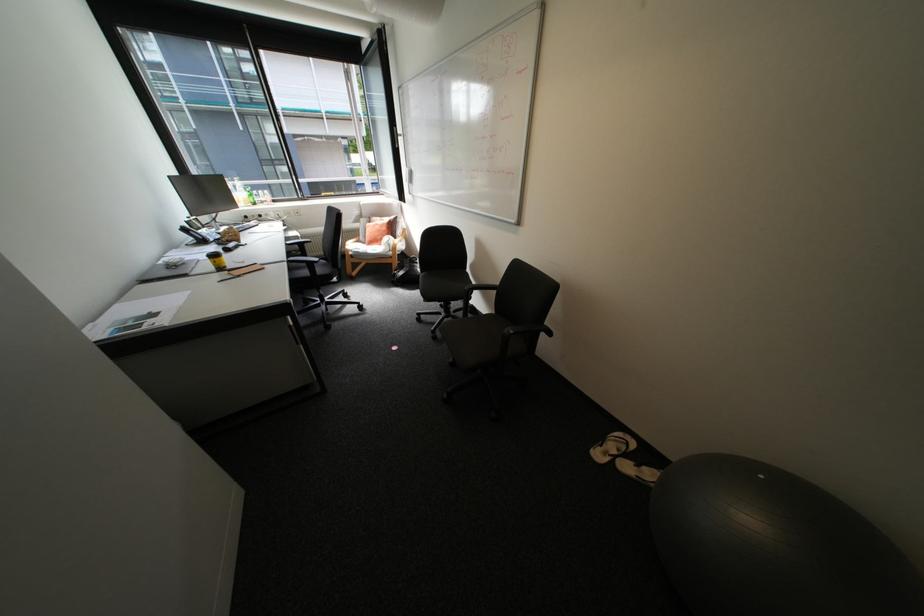
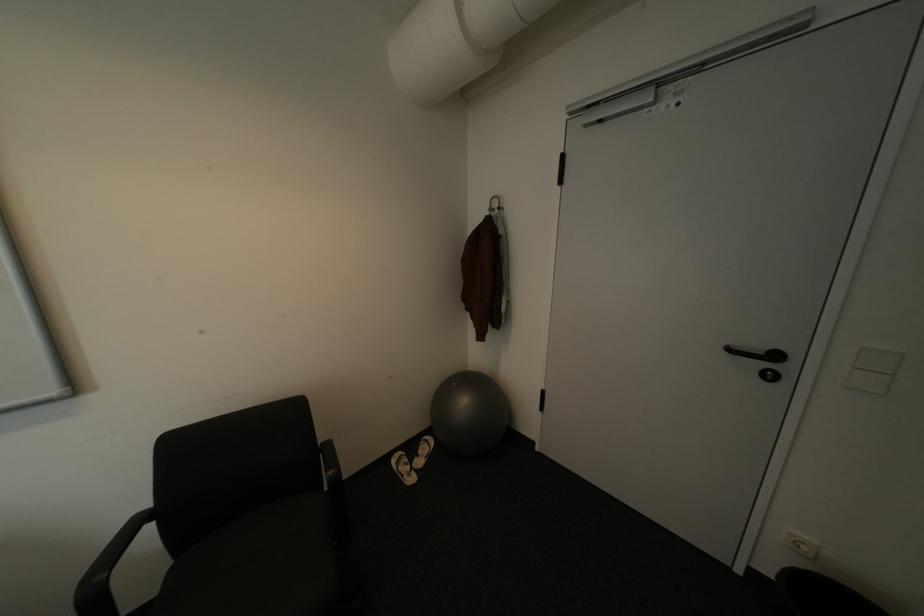
Locate, in the second image, the point that corresponds to point 645,464 in the first image.

(428, 456)